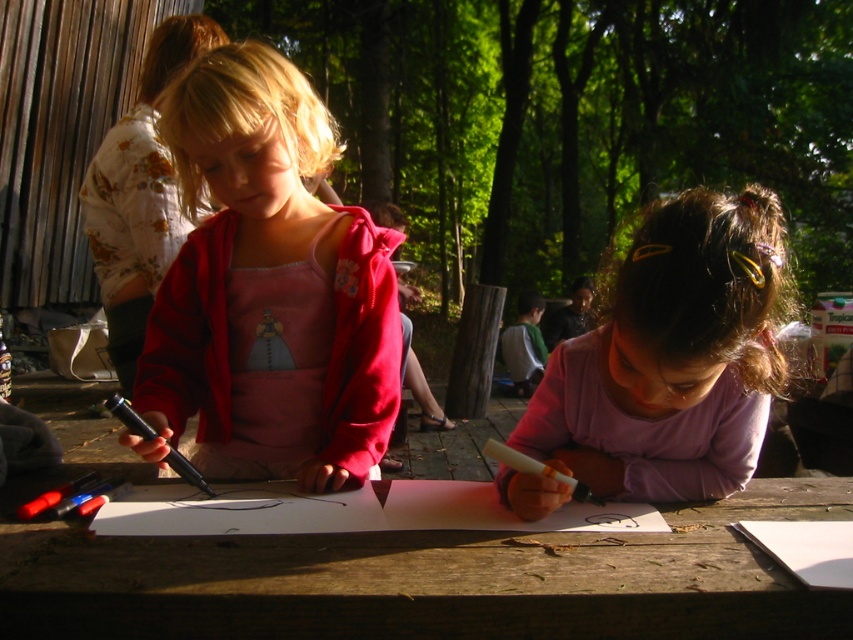
You are standing in front of the wooden table where the two children are drawing. You want to place a new drawing tool at the point closer to you. Which point should you choose between point (231, 609) and point (503, 492)?

Point (231, 609) is closer to the viewer than point (503, 492), so you should choose point (231, 609) to place the new drawing tool.

You are a fashion designer observing the two children at the table. You notice the matte pink hoodie at center and the purple matte shirt at center. Which clothing item is positioned higher on the child wearing them?

The matte pink hoodie at center is above the purple matte shirt at center, so the matte pink hoodie at center is positioned higher.

You are a parent observing the scene. You notice the wooden table at center and the matte pink hoodie at center. Which object is taller?

The matte pink hoodie at center is taller than the wooden table at center.